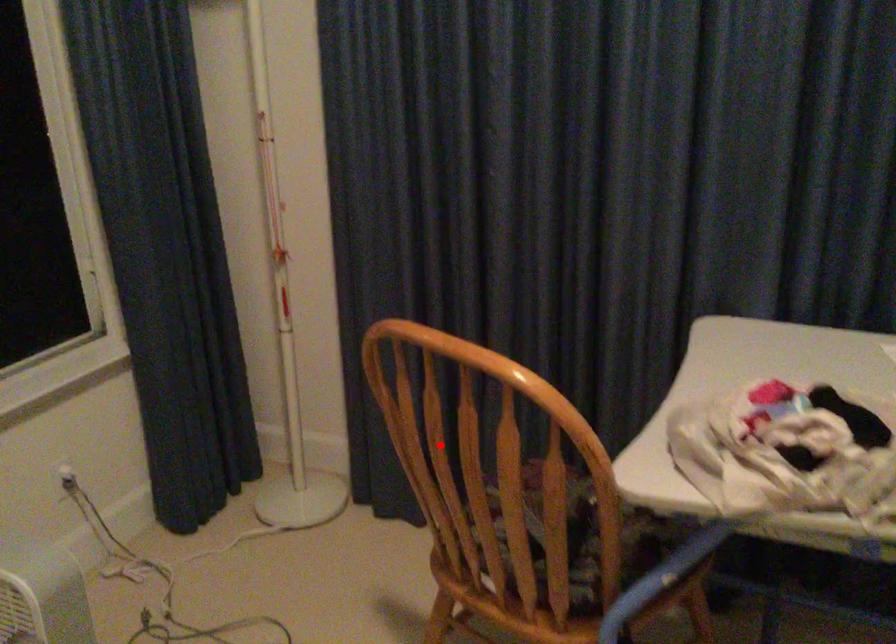
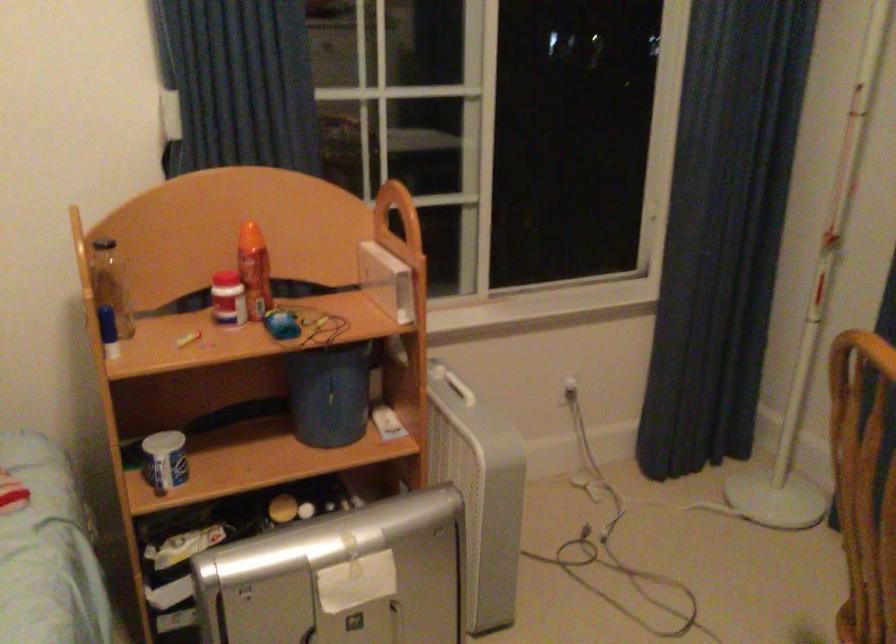
The point at the highlighted location is marked in the first image. Where is the corresponding point in the second image?

(864, 484)